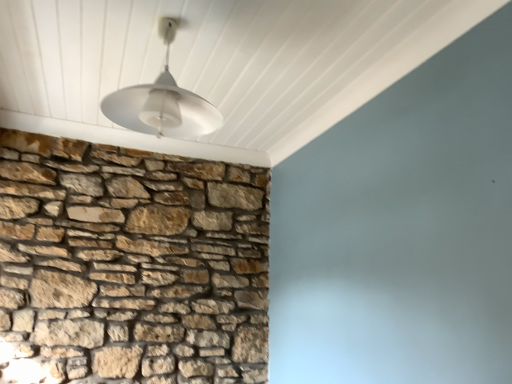
Image resolution: width=512 pixels, height=384 pixels. Describe the element at coordinates (162, 101) in the screenshot. I see `white matte lampshade at upper center` at that location.

Where is `white matte lampshade at upper center`? white matte lampshade at upper center is located at coordinates (162, 101).

Measure the distance between point [172,287] and camera.

The depth of point [172,287] is 2.66 meters.

What are the coordinates of `natural stone wall at left` in the screenshot? It's located at (132, 263).

Describe the element at coordinates (132, 263) in the screenshot. I see `natural stone wall at left` at that location.

The image size is (512, 384). I want to click on white matte lampshade at upper center, so coord(162,101).

Is white matte lampshade at upper center to the left or to the right of natural stone wall at left in the image?

white matte lampshade at upper center is positioned on natural stone wall at left's right side.

Considering the positions of objects white matte lampshade at upper center and natural stone wall at left in the image provided, who is behind, white matte lampshade at upper center or natural stone wall at left?

natural stone wall at left is further away from the camera.

Is point (173, 122) closer to camera compared to point (195, 281)?

Yes, point (173, 122) is in front of point (195, 281).

From the image's perspective, which is above, white matte lampshade at upper center or natural stone wall at left?

white matte lampshade at upper center appears higher in the image.

From a real-world perspective, which object stands above the other?

In real-world perspective, white matte lampshade at upper center is above.

Does white matte lampshade at upper center have a lesser width compared to natural stone wall at left?

In fact, white matte lampshade at upper center might be wider than natural stone wall at left.

Consider the image. Is white matte lampshade at upper center shorter than natural stone wall at left?

Correct, white matte lampshade at upper center is not as tall as natural stone wall at left.

Can you confirm if white matte lampshade at upper center is bigger than natural stone wall at left?

Incorrect, white matte lampshade at upper center is not larger than natural stone wall at left.

Is white matte lampshade at upper center positioned beyond the bounds of natural stone wall at left?

white matte lampshade at upper center lies outside natural stone wall at left's area.

Are white matte lampshade at upper center and natural stone wall at left far apart?

white matte lampshade at upper center is positioned a significant distance from natural stone wall at left.

Looking at this image, is white matte lampshade at upper center facing away from natural stone wall at left?

Yes.

What's the angular difference between white matte lampshade at upper center and natural stone wall at left's facing directions?

white matte lampshade at upper center and natural stone wall at left are facing 0.0425 degrees away from each other.

Locate an element on the screen. The width and height of the screenshot is (512, 384). lamp on the right of the natural stone wall at left is located at coordinates (162, 101).

Considering the positions of objects natural stone wall at left and white matte lampshade at upper center in the image provided, who is more to the left, natural stone wall at left or white matte lampshade at upper center?

natural stone wall at left.

Between natural stone wall at left and white matte lampshade at upper center, which one is positioned behind?

Positioned behind is natural stone wall at left.

Is point (226, 366) in front of point (115, 106)?

That is False.

From the image's perspective, is natural stone wall at left below white matte lampshade at upper center?

Indeed, from the image's perspective, natural stone wall at left is shown beneath white matte lampshade at upper center.

From a real-world perspective, is natural stone wall at left physically above white matte lampshade at upper center?

Incorrect, from a real-world perspective, natural stone wall at left is lower than white matte lampshade at upper center.

Considering the sizes of objects natural stone wall at left and white matte lampshade at upper center in the image provided, who is thinner, natural stone wall at left or white matte lampshade at upper center?

Thinner between the two is natural stone wall at left.

Considering the relative sizes of natural stone wall at left and white matte lampshade at upper center in the image provided, is natural stone wall at left shorter than white matte lampshade at upper center?

No.

Between natural stone wall at left and white matte lampshade at upper center, which one has larger size?

Bigger between the two is natural stone wall at left.

Is natural stone wall at left not within white matte lampshade at upper center?

Yes, natural stone wall at left is outside of white matte lampshade at upper center.

Is natural stone wall at left next to white matte lampshade at upper center?

They are not placed beside each other.

Is white matte lampshade at upper center at the back of natural stone wall at left?

That's not correct — natural stone wall at left is not looking away from white matte lampshade at upper center.

You are a GUI agent. You are given a task and a screenshot of the screen. Output one action in this format:
    pyautogui.click(x=<x>, y=<y>)
    Task: Click on the brickwork that appears below the white matte lampshade at upper center (from a real-world perspective)
    
    Given the screenshot: What is the action you would take?
    pyautogui.click(x=132, y=263)

Image resolution: width=512 pixels, height=384 pixels. Identify the location of lamp on the right of natural stone wall at left. (162, 101).

Where is `brickwork on the left side of white matte lampshade at upper center`? The image size is (512, 384). brickwork on the left side of white matte lampshade at upper center is located at coordinates (132, 263).